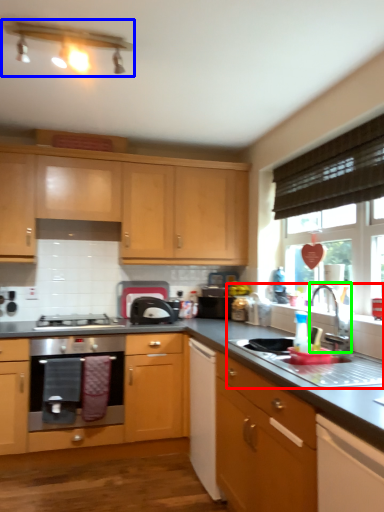
Question: Estimate the real-world distances between objects in this image. Which object is closer to sink (highlighted by a red box), light fixture (highlighted by a blue box) or tap (highlighted by a green box)?

Choices:
 (A) light fixture
 (B) tap

Answer: (B)